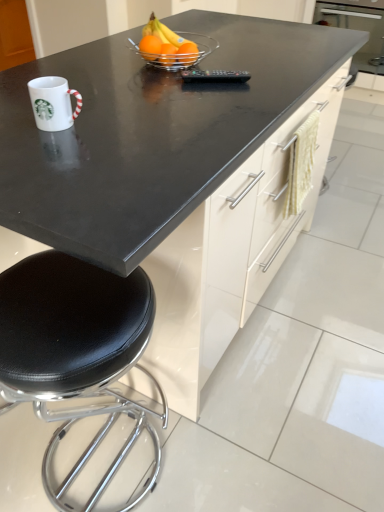
Question: From the image's perspective, is translucent glass bowl at center above orange matte at center, acting as the third orange starting from the left?

Choices:
 (A) no
 (B) yes

Answer: (B)

Question: Is translucent glass bowl at center outside orange matte at center, acting as the third orange starting from the left?

Choices:
 (A) yes
 (B) no

Answer: (A)

Question: Does translucent glass bowl at center appear on the left side of orange matte at center, acting as the third orange starting from the left?

Choices:
 (A) yes
 (B) no

Answer: (A)

Question: Can you confirm if translucent glass bowl at center is smaller than orange matte at center, positioned as the 1th orange in right-to-left order?

Choices:
 (A) no
 (B) yes

Answer: (A)

Question: Can you confirm if translucent glass bowl at center is shorter than orange matte at center, acting as the third orange starting from the left?

Choices:
 (A) yes
 (B) no

Answer: (B)

Question: Is translucent glass bowl at center turned away from orange matte at center, acting as the third orange starting from the left?

Choices:
 (A) no
 (B) yes

Answer: (A)

Question: Is orange matte at center, positioned as the 1th orange in right-to-left order, bigger than orange matte at center, which ranks as the 1th orange in left-to-right order?

Choices:
 (A) no
 (B) yes

Answer: (B)

Question: Can you confirm if orange matte at center, acting as the third orange starting from the left, is smaller than orange matte at center, which ranks as the 1th orange in left-to-right order?

Choices:
 (A) yes
 (B) no

Answer: (B)

Question: From the image's perspective, is orange matte at center, acting as the third orange starting from the left, located above orange matte at center, which ranks as the 1th orange in left-to-right order?

Choices:
 (A) no
 (B) yes

Answer: (A)

Question: Is orange matte at center, acting as the third orange starting from the right, inside orange matte at center, acting as the third orange starting from the left?

Choices:
 (A) no
 (B) yes

Answer: (A)

Question: Considering the relative positions of orange matte at center, positioned as the 1th orange in right-to-left order, and orange matte at center, acting as the third orange starting from the right, in the image provided, is orange matte at center, positioned as the 1th orange in right-to-left order, behind orange matte at center, acting as the third orange starting from the right,?

Choices:
 (A) no
 (B) yes

Answer: (A)

Question: Can you confirm if orange matte at center, positioned as the 1th orange in right-to-left order, is wider than orange matte at center, acting as the third orange starting from the right?

Choices:
 (A) yes
 (B) no

Answer: (A)

Question: Is black glossy countertop at center positioned beyond the bounds of orange matte at center, acting as the third orange starting from the left?

Choices:
 (A) no
 (B) yes

Answer: (B)